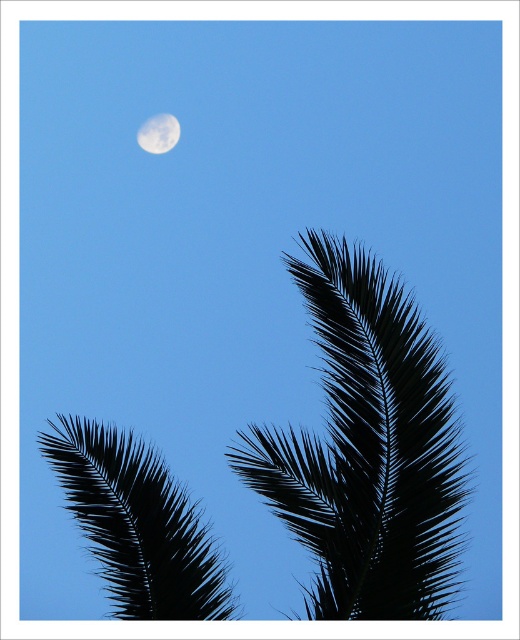
Is black spiky palm at center bigger than white/smooth moon at upper center?

Correct, black spiky palm at center is larger in size than white/smooth moon at upper center.

In the scene shown: Is black spiky palm at center further to the viewer compared to white/smooth moon at upper center?

No, it is in front of white/smooth moon at upper center.

Find the location of a particular element. black spiky palm at center is located at coordinates (368, 449).

The image size is (520, 640). Find the location of `black spiky palm at center`. black spiky palm at center is located at coordinates (368, 449).

Between point (140, 580) and point (169, 138), which one is positioned in front?

Point (140, 580) is in front.

You are a GUI agent. You are given a task and a screenshot of the screen. Output one action in this format:
    pyautogui.click(x=<x>, y=<y>)
    Task: Click on the black matte palm leaf at lower left
    
    Given the screenshot: What is the action you would take?
    pos(137,524)

Is black spiky palm at center to the right of black matte palm leaf at lower left from the viewer's perspective?

Correct, you'll find black spiky palm at center to the right of black matte palm leaf at lower left.

In the scene shown: Does black spiky palm at center appear under black matte palm leaf at lower left?

No.

Is point (368, 596) closer to viewer compared to point (206, 618)?

Yes, it is.

Find the location of a particular element. black spiky palm at center is located at coordinates (368, 449).